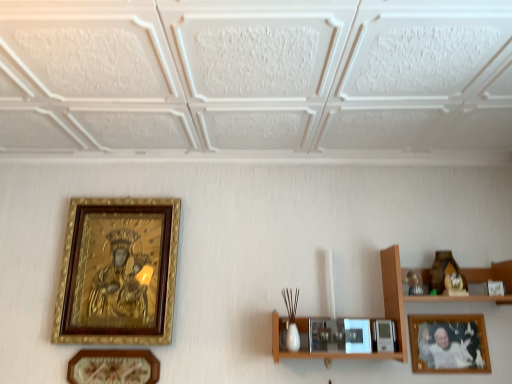
Question: Does point [116, 249] appear closer or farther from the camera than point [89, 360]?

Choices:
 (A) closer
 (B) farther

Answer: (B)

Question: Is goldwooden framepicture frame at left, the 1th picture frame from the left, in front of or behind matte gold picture frame at lower left, marked as the 2th picture frame in a right-to-left arrangement, in the image?

Choices:
 (A) front
 (B) behind

Answer: (B)

Question: Which of these objects is positioned closest to the wooden shelf at right?

Choices:
 (A) goldwooden framepicture frame at left, the 1th picture frame from the left
 (B) matte gold picture frame at lower left, marked as the 2th picture frame in a right-to-left arrangement
 (C) wooden framed photo at lower right, which is counted as the 3th picture frame, starting from the left

Answer: (C)

Question: Considering the real-world distances, which object is farthest from the wooden framed photo at lower right, which is counted as the 3th picture frame, starting from the left?

Choices:
 (A) goldwooden framepicture frame at left, marked as the third picture frame in a right-to-left arrangement
 (B) matte gold picture frame at lower left, marked as the 2th picture frame in a right-to-left arrangement
 (C) wooden shelf at right

Answer: (A)